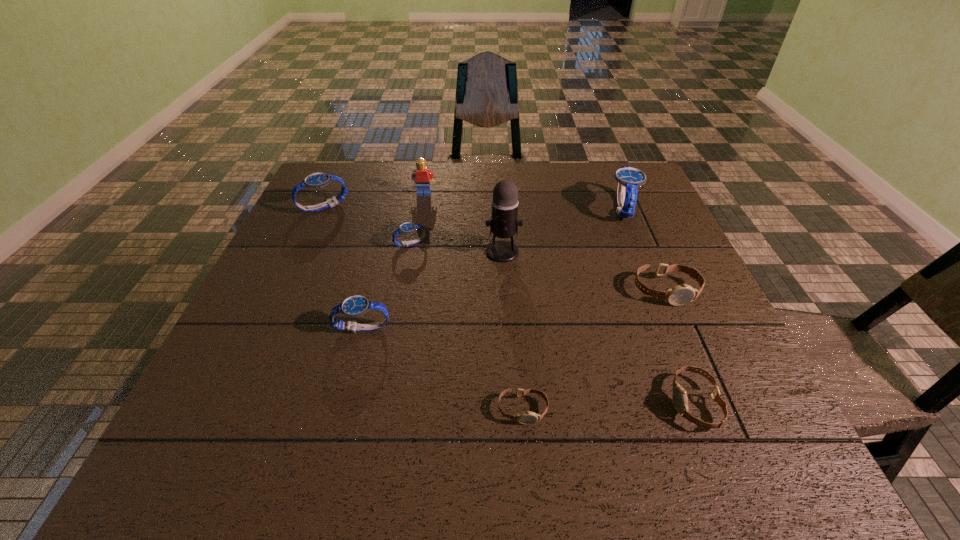
Identify the location of object that ranks as the second closest to the Lego. This screenshot has height=540, width=960. (407, 227).

Find the location of `the sixth closest watch to the leftmost object`. the sixth closest watch to the leftmost object is located at coordinates (680, 401).

Point out which watch is positioned as the second nearest to the biggest beige watch. Please provide its 2D coordinates. Your answer should be formatted as a tuple, i.e. [(x, y)], where the tuple contains the x and y coordinates of a point satisfying the conditions above.

[(629, 179)]

I want to click on blue watch that is the closest to the second biggest beige watch, so click(x=629, y=179).

The width and height of the screenshot is (960, 540). What are the coordinates of `blue watch that is the third nearest to the Lego` in the screenshot? It's located at (354, 306).

This screenshot has height=540, width=960. What are the coordinates of `beige watch that is the second closest to the fourth nearest watch` in the screenshot? It's located at (528, 417).

Locate which beige watch is the second closest to the third nearest watch. Please provide its 2D coordinates. Your answer should be formatted as a tuple, i.e. [(x, y)], where the tuple contains the x and y coordinates of a point satisfying the conditions above.

[(679, 295)]

Image resolution: width=960 pixels, height=540 pixels. Identify the location of vacant space that satisfies the following two spatial constraints: 1. on the front-facing side of the microphone; 2. on the right side of the Lego. (414, 252).

Locate an element on the screen. vacant region that satisfies the following two spatial constraints: 1. on the front side of the fourth tallest object; 2. on the right side of the microphone is located at coordinates (303, 252).